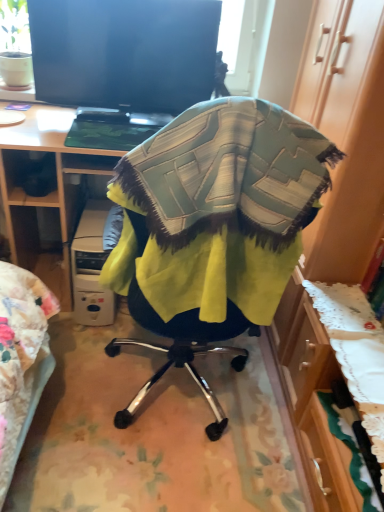
At what (x,y) coordinates should I click in order to perform the action: click on black glossy screen at upper center. Please return your answer as a coordinate pair (x, y). This screenshot has width=384, height=512. Looking at the image, I should click on (124, 52).

Who is bigger, white plastic computer at lower left or wooden desk at center?

Bigger between the two is wooden desk at center.

From the image's perspective, is white plastic computer at lower left below wooden desk at center?

Yes, from the image's perspective, white plastic computer at lower left is below wooden desk at center.

Is white plastic computer at lower left wider than wooden desk at center?

Incorrect, the width of white plastic computer at lower left does not surpass that of wooden desk at center.

From a real-world perspective, is white plastic computer at lower left on wooden desk at center?

No, from a real-world perspective, white plastic computer at lower left is not above wooden desk at center.

The height and width of the screenshot is (512, 384). What are the coordinates of `television above the wooden desk at center (from the image's perspective)` in the screenshot? It's located at (x=124, y=52).

Does black glossy screen at upper center turn towards wooden desk at center?

No, black glossy screen at upper center does not turn towards wooden desk at center.

Does point (162, 68) come closer to viewer compared to point (45, 135)?

No, it is not.

Identify the location of desk below the black glossy screen at upper center (from a real-world perspective). The width and height of the screenshot is (384, 512). (49, 193).

Does wooden desk at center have a lesser height compared to black glossy screen at upper center?

No, wooden desk at center is not shorter than black glossy screen at upper center.

Which object is closer to the camera, wooden desk at center or black glossy screen at upper center?

wooden desk at center is more forward.

Is wooden desk at center at the right side of black glossy screen at upper center?

Incorrect, wooden desk at center is not on the right side of black glossy screen at upper center.

From the image's perspective, relative to textured fabric chair at center, is white plastic computer at lower left above or below?

Clearly, from the image's perspective, white plastic computer at lower left is below textured fabric chair at center.

Considering the relative positions of white plastic computer at lower left and textured fabric chair at center in the image provided, is white plastic computer at lower left to the right of textured fabric chair at center from the viewer's perspective?

No, white plastic computer at lower left is not to the right of textured fabric chair at center.

Which of these two, white plastic computer at lower left or textured fabric chair at center, is bigger?

With larger size is textured fabric chair at center.

Which of these two, white plastic computer at lower left or textured fabric chair at center, is thinner?

textured fabric chair at center is thinner.

Is wooden desk at center looking in the opposite direction of textured fabric chair at center?

No, textured fabric chair at center is not at the back of wooden desk at center.

Which object is positioned more to the right, wooden desk at center or textured fabric chair at center?

textured fabric chair at center.

Which is further, (x=9, y=201) or (x=276, y=172)?

The point (x=9, y=201) is more distant.

From a real-world perspective, is wooden desk at center on textured fabric chair at center?

No, from a real-world perspective, wooden desk at center is not over textured fabric chair at center

Is wooden desk at center located outside white plastic computer at lower left?

Yes, wooden desk at center is outside of white plastic computer at lower left.

From the picture: Who is shorter, wooden desk at center or white plastic computer at lower left?

Standing shorter between the two is white plastic computer at lower left.

Is wooden desk at center to the left of white plastic computer at lower left from the viewer's perspective?

Yes, wooden desk at center is to the left of white plastic computer at lower left.

Is wooden desk at center facing towards white plastic computer at lower left?

Yes, wooden desk at center is oriented towards white plastic computer at lower left.

Which of these two, black glossy screen at upper center or white plastic computer at lower left, is thinner?

black glossy screen at upper center.

From the image's perspective, who appears lower, black glossy screen at upper center or white plastic computer at lower left?

white plastic computer at lower left.

You are a GUI agent. You are given a task and a screenshot of the screen. Output one action in this format:
    pyautogui.click(x=<x>, y=<y>)
    Task: Click on the desk lying above the white plastic computer at lower left (from the image's perspective)
    The image size is (384, 512).
    Given the screenshot: What is the action you would take?
    pyautogui.click(x=49, y=193)

You are a GUI agent. You are given a task and a screenshot of the screen. Output one action in this format:
    pyautogui.click(x=<x>, y=<y>)
    Task: Click on the television behind the wooden desk at center
    
    Given the screenshot: What is the action you would take?
    pyautogui.click(x=124, y=52)

Considering their positions, is white plastic computer at lower left positioned closer to wooden desk at center than black glossy screen at upper center?

white plastic computer at lower left is closer to wooden desk at center.

When comparing their distances from wooden desk at center, does textured fabric chair at center or black glossy screen at upper center seem further?

The object further to wooden desk at center is textured fabric chair at center.

Which object lies further to the anchor point white plastic computer at lower left, wooden desk at center or textured fabric chair at center?

textured fabric chair at center lies further to white plastic computer at lower left than the other object.

Which object lies nearer to the anchor point textured fabric chair at center, white plastic computer at lower left or black glossy screen at upper center?

The object closer to textured fabric chair at center is white plastic computer at lower left.

Looking at the image, which one is located closer to black glossy screen at upper center, wooden desk at center or textured fabric chair at center?

The object closer to black glossy screen at upper center is wooden desk at center.

From the image, which object appears to be farther from wooden desk at center, textured fabric chair at center or white plastic computer at lower left?

textured fabric chair at center.

Estimate the real-world distances between objects in this image. Which object is further from textured fabric chair at center, white plastic computer at lower left or wooden desk at center?

white plastic computer at lower left is positioned further to the anchor textured fabric chair at center.

Based on their spatial positions, is textured fabric chair at center or black glossy screen at upper center closer to white plastic computer at lower left?

black glossy screen at upper center lies closer to white plastic computer at lower left than the other object.

Find the location of a particular element. Image resolution: width=384 pixels, height=512 pixels. desk between textured fabric chair at center and white plastic computer at lower left in the front-back direction is located at coordinates (49, 193).

Where is `desk located between textured fabric chair at center and black glossy screen at upper center in the depth direction`? The width and height of the screenshot is (384, 512). desk located between textured fabric chair at center and black glossy screen at upper center in the depth direction is located at coordinates (49, 193).

At what (x,y) coordinates should I click in order to perform the action: click on television between textured fabric chair at center and white plastic computer at lower left from front to back. Please return your answer as a coordinate pair (x, y). The width and height of the screenshot is (384, 512). Looking at the image, I should click on (124, 52).

At what (x,y) coordinates should I click in order to perform the action: click on desk between black glossy screen at upper center and white plastic computer at lower left in the up-down direction. Please return your answer as a coordinate pair (x, y). The width and height of the screenshot is (384, 512). Looking at the image, I should click on (49, 193).